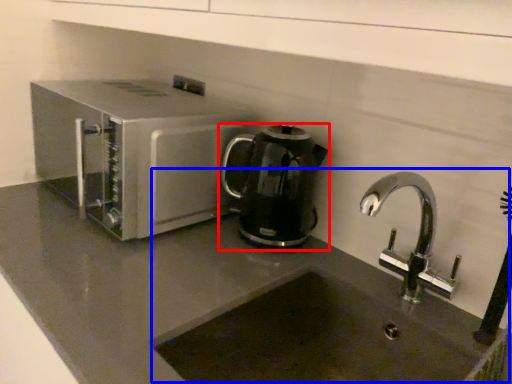
Question: Which object appears closest to the camera in this image, kitchen appliance (highlighted by a red box) or sink (highlighted by a blue box)?

Choices:
 (A) kitchen appliance
 (B) sink

Answer: (B)